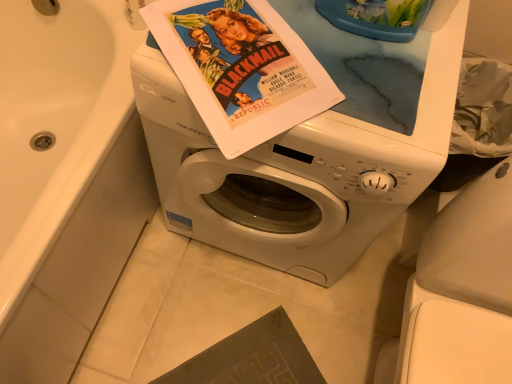
Locate an element on the screen. empty space that is ontop of white glossy washing machine at center (from a real-world perspective) is located at coordinates (328, 59).